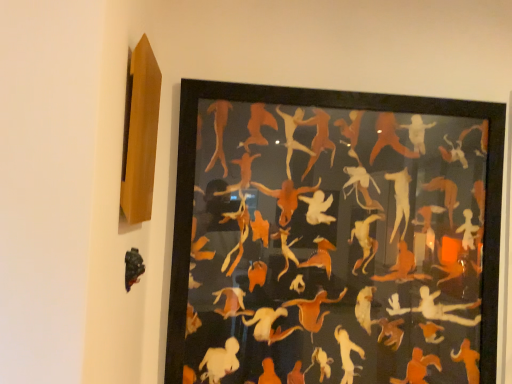
Where is `black matte sculpture at lower left`? The height and width of the screenshot is (384, 512). black matte sculpture at lower left is located at coordinates (133, 268).

Describe the element at coordinates (133, 268) in the screenshot. I see `black matte sculpture at lower left` at that location.

Locate an element on the screen. The image size is (512, 384). orange matte paper cutouts at center is located at coordinates (334, 237).

This screenshot has width=512, height=384. Describe the element at coordinates (334, 237) in the screenshot. I see `orange matte paper cutouts at center` at that location.

At what (x,y) coordinates should I click in order to perform the action: click on black matte sculpture at lower left. Please return your answer as a coordinate pair (x, y). The height and width of the screenshot is (384, 512). Looking at the image, I should click on (133, 268).

Between orange matte paper cutouts at center and black matte sculpture at lower left, which one appears on the right side from the viewer's perspective?

orange matte paper cutouts at center.

In the image, is orange matte paper cutouts at center positioned in front of or behind black matte sculpture at lower left?

In the image, orange matte paper cutouts at center appears behind black matte sculpture at lower left.

Is point (410, 278) positioned in front of point (142, 269)?

No.

From the image's perspective, which one is positioned higher, orange matte paper cutouts at center or black matte sculpture at lower left?

orange matte paper cutouts at center.

In the scene shown: From a real-world perspective, is orange matte paper cutouts at center on black matte sculpture at lower left?

Correct, in the physical world, orange matte paper cutouts at center is higher than black matte sculpture at lower left.

Which of these two, orange matte paper cutouts at center or black matte sculpture at lower left, is thinner?

black matte sculpture at lower left is thinner.

Is orange matte paper cutouts at center shorter than black matte sculpture at lower left?

No.

From the picture: Which of these two, orange matte paper cutouts at center or black matte sculpture at lower left, is bigger?

Bigger between the two is orange matte paper cutouts at center.

Is orange matte paper cutouts at center located outside black matte sculpture at lower left?

That's correct, orange matte paper cutouts at center is outside of black matte sculpture at lower left.

Are orange matte paper cutouts at center and black matte sculpture at lower left beside each other?

No, orange matte paper cutouts at center is not beside black matte sculpture at lower left.

Is orange matte paper cutouts at center facing towards black matte sculpture at lower left?

Yes, orange matte paper cutouts at center is facing black matte sculpture at lower left.

How different are the orientations of orange matte paper cutouts at center and black matte sculpture at lower left in degrees?

90.6 degrees.

Find the location of a particular element. This screenshot has height=384, width=512. picture frame on the right of black matte sculpture at lower left is located at coordinates (334, 237).

Does black matte sculpture at lower left appear on the right side of orange matte paper cutouts at center?

Incorrect, black matte sculpture at lower left is not on the right side of orange matte paper cutouts at center.

Considering the relative positions of black matte sculpture at lower left and orange matte paper cutouts at center in the image provided, is black matte sculpture at lower left in front of orange matte paper cutouts at center?

That is True.

Is point (129, 252) more distant than point (187, 223)?

No.

From the image's perspective, which one is positioned higher, black matte sculpture at lower left or orange matte paper cutouts at center?

orange matte paper cutouts at center.

From a real-world perspective, is black matte sculpture at lower left on orange matte paper cutouts at center?

Incorrect, from a real-world perspective, black matte sculpture at lower left is lower than orange matte paper cutouts at center.

Which object is thinner, black matte sculpture at lower left or orange matte paper cutouts at center?

Thinner between the two is black matte sculpture at lower left.

Does black matte sculpture at lower left have a greater height compared to orange matte paper cutouts at center?

No, black matte sculpture at lower left is not taller than orange matte paper cutouts at center.

Considering the relative sizes of black matte sculpture at lower left and orange matte paper cutouts at center in the image provided, is black matte sculpture at lower left smaller than orange matte paper cutouts at center?

Correct, black matte sculpture at lower left occupies less space than orange matte paper cutouts at center.

Could orange matte paper cutouts at center be considered to be inside black matte sculpture at lower left?

That's incorrect, orange matte paper cutouts at center is not inside black matte sculpture at lower left.

Are black matte sculpture at lower left and orange matte paper cutouts at center far apart?

That's not correct — black matte sculpture at lower left is a little close to orange matte paper cutouts at center.

Is black matte sculpture at lower left positioned with its back to orange matte paper cutouts at center?

No, orange matte paper cutouts at center is not at the back of black matte sculpture at lower left.

How different are the orientations of black matte sculpture at lower left and orange matte paper cutouts at center in degrees?

90.6 degrees.

This screenshot has height=384, width=512. Identify the location of animal on the left of orange matte paper cutouts at center. (133, 268).

The height and width of the screenshot is (384, 512). I want to click on animal in front of the orange matte paper cutouts at center, so coord(133,268).

In the image, there is a black matte sculpture at lower left. Find the location of `picture frame above it (from the image's perspective)`. picture frame above it (from the image's perspective) is located at coordinates (334, 237).